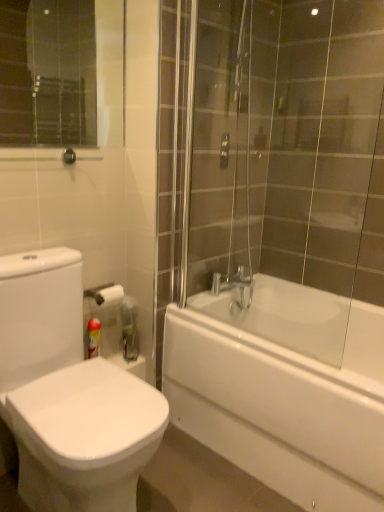
Question: Does red plastic can at lower left have a larger size compared to white glossy bidet at lower left?

Choices:
 (A) yes
 (B) no

Answer: (B)

Question: Can you confirm if red plastic can at lower left is shorter than white glossy bidet at lower left?

Choices:
 (A) yes
 (B) no

Answer: (A)

Question: Considering the relative positions of red plastic can at lower left and white glossy bidet at lower left in the image provided, is red plastic can at lower left in front of white glossy bidet at lower left?

Choices:
 (A) no
 (B) yes

Answer: (A)

Question: From a real-world perspective, is red plastic can at lower left physically above white glossy bidet at lower left?

Choices:
 (A) yes
 (B) no

Answer: (B)

Question: Does red plastic can at lower left have a smaller size compared to white glossy bidet at lower left?

Choices:
 (A) no
 (B) yes

Answer: (B)

Question: In terms of width, does white glossy bathtub at right look wider or thinner when compared to white glossy bidet at lower left?

Choices:
 (A) thin
 (B) wide

Answer: (B)

Question: Would you say white glossy bathtub at right is inside or outside white glossy bidet at lower left?

Choices:
 (A) inside
 (B) outside

Answer: (B)

Question: From the image's perspective, is white glossy bathtub at right located above or below white glossy bidet at lower left?

Choices:
 (A) above
 (B) below

Answer: (B)

Question: Based on their sizes in the image, would you say white glossy bathtub at right is bigger or smaller than white glossy bidet at lower left?

Choices:
 (A) big
 (B) small

Answer: (A)

Question: Would you say white glossy bidet at lower left is to the left or to the right of white glossy bathtub at right in the picture?

Choices:
 (A) right
 (B) left

Answer: (B)

Question: From a real-world perspective, relative to white glossy bathtub at right, is white glossy bidet at lower left vertically above or below?

Choices:
 (A) above
 (B) below

Answer: (A)

Question: In terms of width, does white glossy bidet at lower left look wider or thinner when compared to white glossy bathtub at right?

Choices:
 (A) wide
 (B) thin

Answer: (B)

Question: Considering the positions of point (135, 411) and point (362, 315), is point (135, 411) closer or farther from the camera than point (362, 315)?

Choices:
 (A) closer
 (B) farther

Answer: (A)

Question: Is white glossy bathtub at right taller or shorter than red plastic can at lower left?

Choices:
 (A) tall
 (B) short

Answer: (A)

Question: From the image's perspective, is white glossy bathtub at right located above or below red plastic can at lower left?

Choices:
 (A) below
 (B) above

Answer: (A)